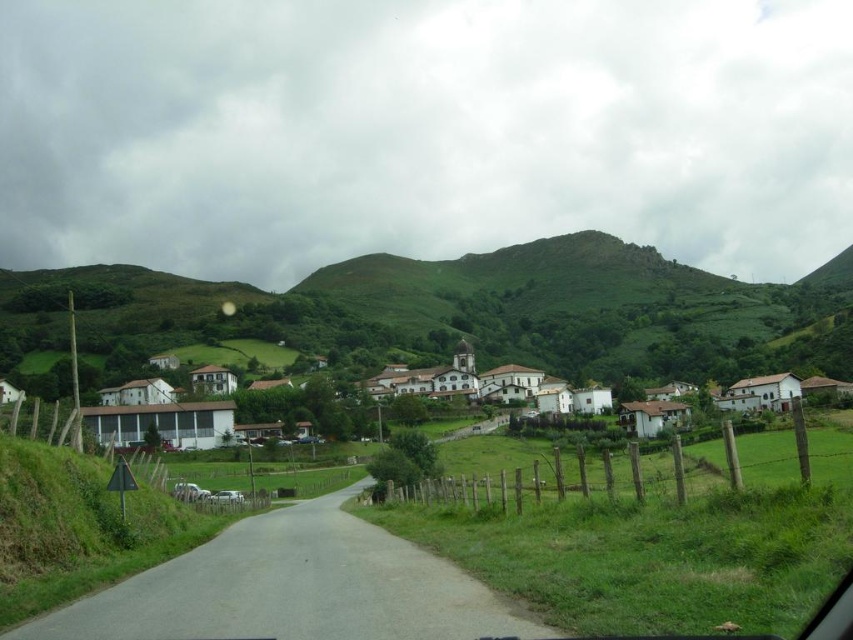
In the scene shown: Is green grassy hill at center positioned before white matte houses at center?

No, it is behind white matte houses at center.

From the picture: Does green grassy hill at center have a lesser height compared to white matte houses at center?

In fact, green grassy hill at center may be taller than white matte houses at center.

Who is more distant from viewer, (x=815, y=342) or (x=135, y=417)?

Positioned behind is point (x=815, y=342).

Identify the location of green grassy hill at center. The height and width of the screenshot is (640, 853). (459, 310).